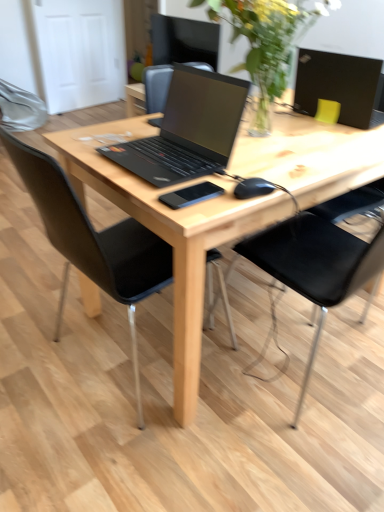
At what (x,y) coordinates should I click in order to perform the action: click on vacant area that is situated to the right of translucent glass vase at center. Please return your answer as a coordinate pair (x, y). The height and width of the screenshot is (512, 384). Looking at the image, I should click on (332, 138).